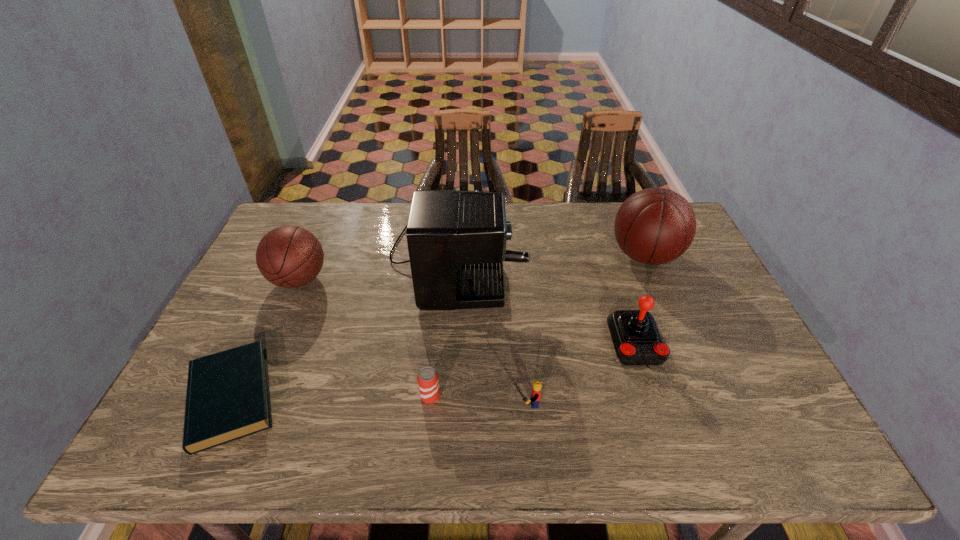
I want to click on free point between the beer can and the left basketball, so click(365, 338).

Locate an element on the screen. The width and height of the screenshot is (960, 540). free area in between the fourth shortest object and the third shortest object is located at coordinates (581, 374).

Find the location of `free space between the beer can and the taller basketball`. free space between the beer can and the taller basketball is located at coordinates (538, 326).

Image resolution: width=960 pixels, height=540 pixels. In order to click on free space that is in between the fourth tallest object and the third shortest object in this screenshot , I will do `click(581, 374)`.

Find the location of a particular element. vacant space in between the shortest object and the taller basketball is located at coordinates (438, 327).

Locate an element on the screen. free point between the beer can and the fifth tallest object is located at coordinates (478, 400).

This screenshot has width=960, height=540. In order to click on vacant region between the shortest object and the third shortest object in this screenshot , I will do `click(378, 400)`.

Identify the location of object that is the second closest to the beer can. Image resolution: width=960 pixels, height=540 pixels. (456, 240).

Point out which object is positioned as the third nearest to the joystick. Please provide its 2D coordinates. Your answer should be formatted as a tuple, i.e. [(x, y)], where the tuple contains the x and y coordinates of a point satisfying the conditions above.

[(537, 385)]

What are the coordinates of `vacant region that satisfies the following two spatial constraints: 1. on the back side of the second shortest object; 2. on the left side of the book` in the screenshot? It's located at (232, 396).